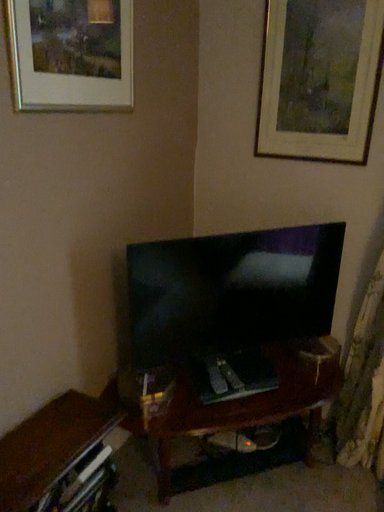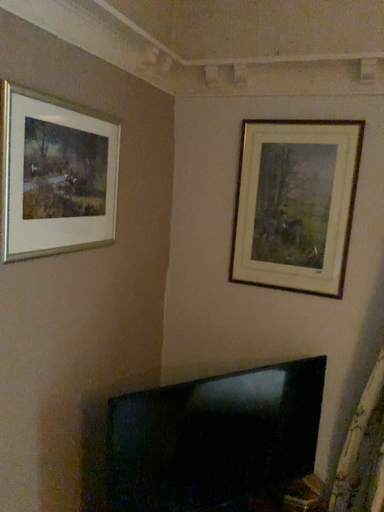
Question: Which way did the camera rotate in the video?

Choices:
 (A) rotated left
 (B) rotated right

Answer: (B)